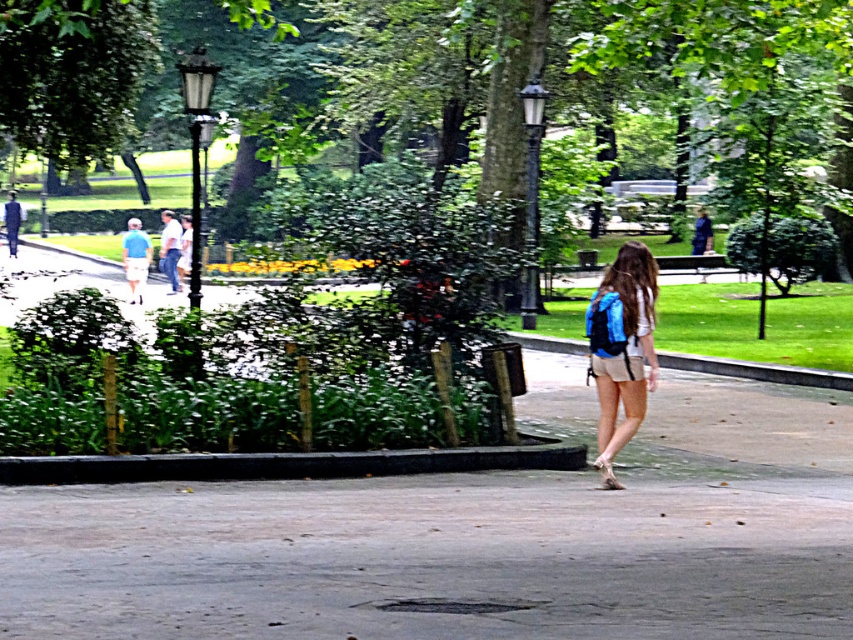
You are standing on the gray concrete pavement at center and want to place a small plant pot in front of the blue fabric backpack at center. Can you do this without moving the backpack?

The gray concrete pavement at center is closer to the viewer than the blue fabric backpack at center, so placing the plant pot in front of the backpack would require placing it between the pavement and the backpack, which is possible without moving the backpack.

You are standing at the camera position in the park scene. There are two points marked in the image, point A at coordinates point (x=720, y=600) and point B at coordinates point (x=627, y=317). Which point is nearer to you?

Point A at coordinates point (x=720, y=600) is closer to the camera than point B at coordinates point (x=627, y=317).